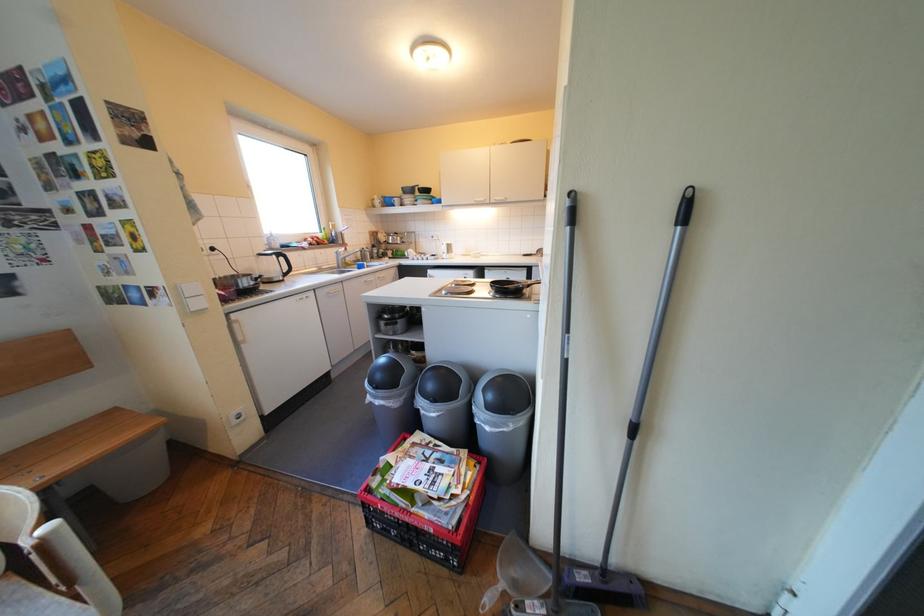
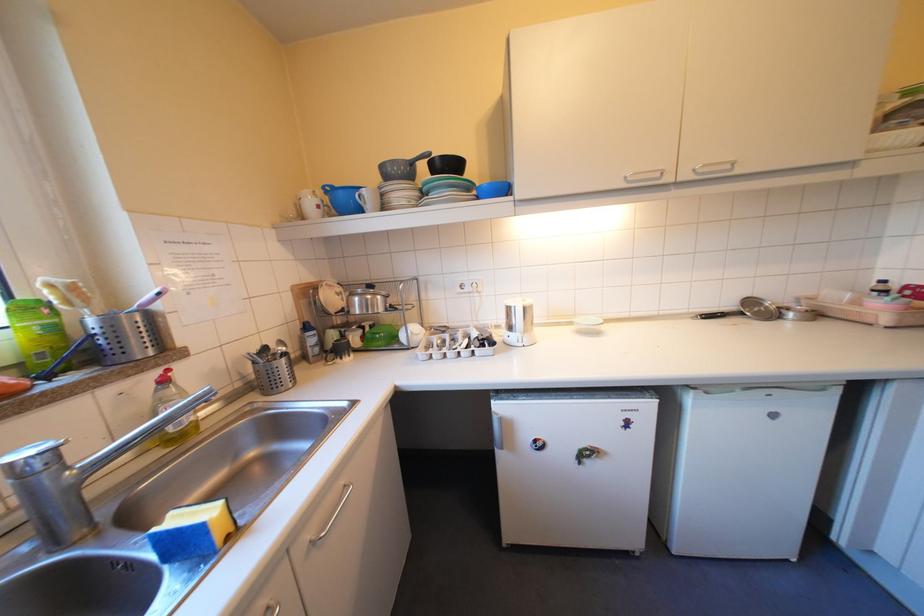
Question: The images are taken continuously from a first-person perspective. In which direction are you moving?

Choices:
 (A) Left
 (B) Right
 (C) Forward
 (D) Backward

Answer: (C)